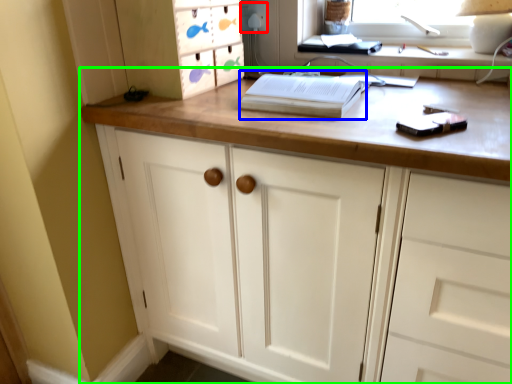
Question: Which is nearer to the electric outlet (highlighted by a red box)? paperback book (highlighted by a blue box) or chest of drawers (highlighted by a green box).

Choices:
 (A) paperback book
 (B) chest of drawers

Answer: (A)